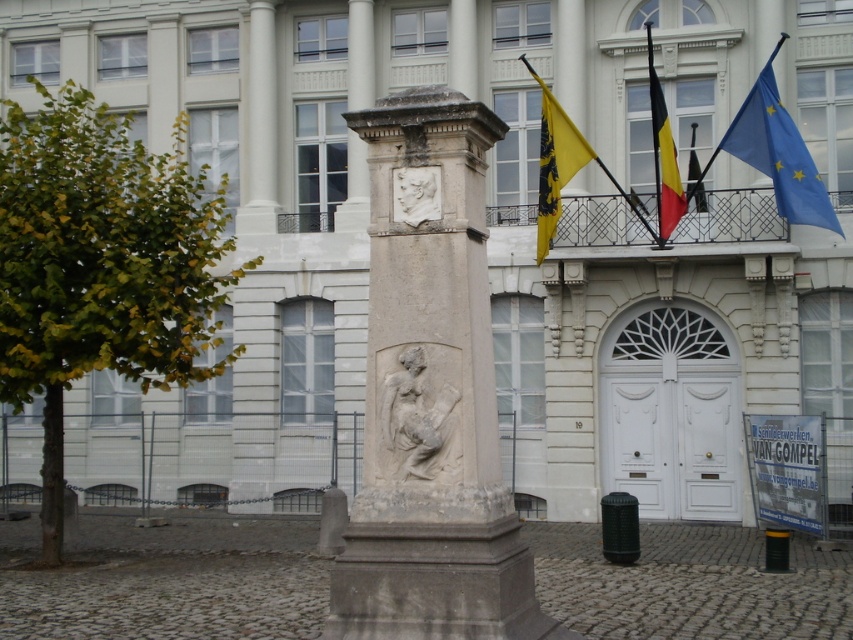
You are an architect inspecting the monument and the building. You notice the yellow fabric flagpole at upper center and the yellow fabric flag at upper center. Which object is located above the other?

The yellow fabric flagpole at upper center is positioned over the yellow fabric flag at upper center, meaning it is above the flag.

You are an architect analyzing the monument and the building in the image. The monument has a relief sculpture with a seated figure holding a scroll and another relief of a man above it. The building has a balcony with ornate railings. You need to place a new flagpole at the same 2D location as the yellow fabric flag at upper center. What are the coordinates where you should place the new flagpole?

The coordinates for placing the new flagpole should be at point (x=554, y=161), matching the 2D location of the yellow fabric flag at upper center.

You are an architect inspecting the monument. You notice the yellow fabric flagpole at upper center and the white marble bust at center. Which object is taller?

The yellow fabric flagpole at upper center is taller than the white marble bust at center.